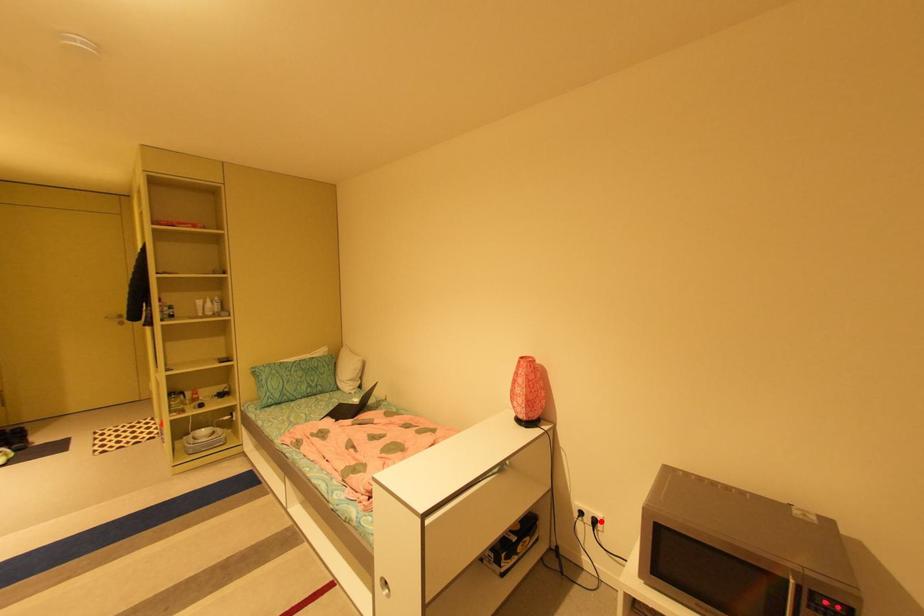
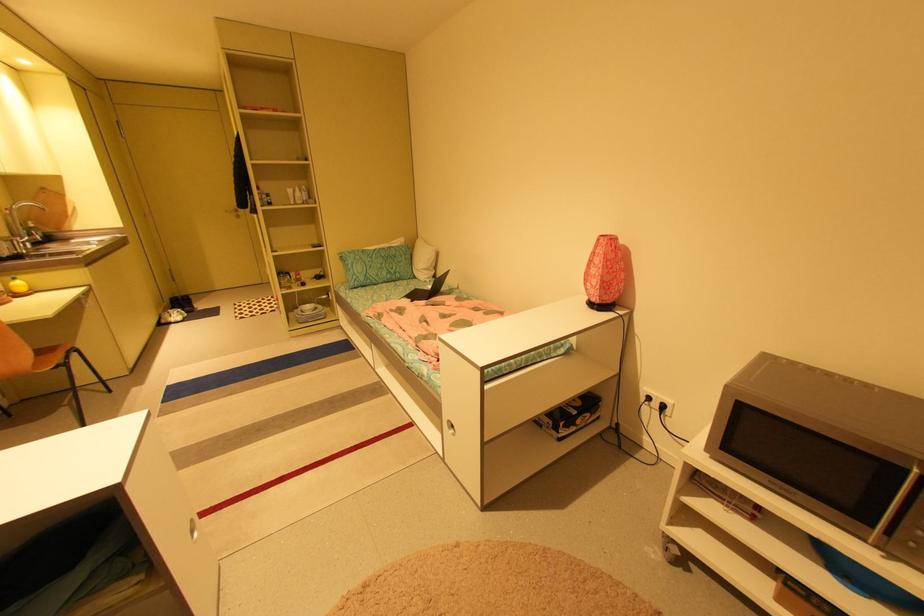
Where in the second image is the point corresponding to the highlighted location from the first image?

(669, 407)